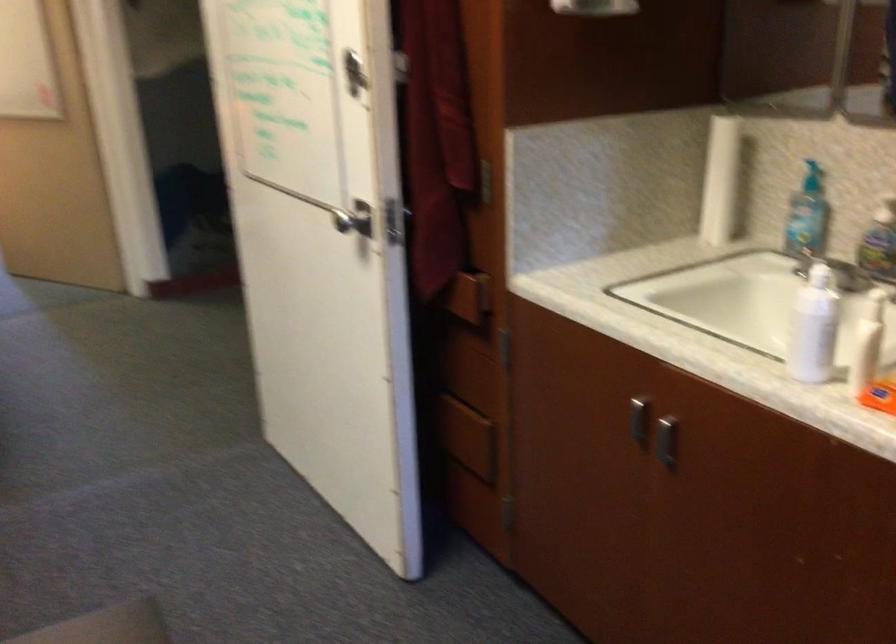
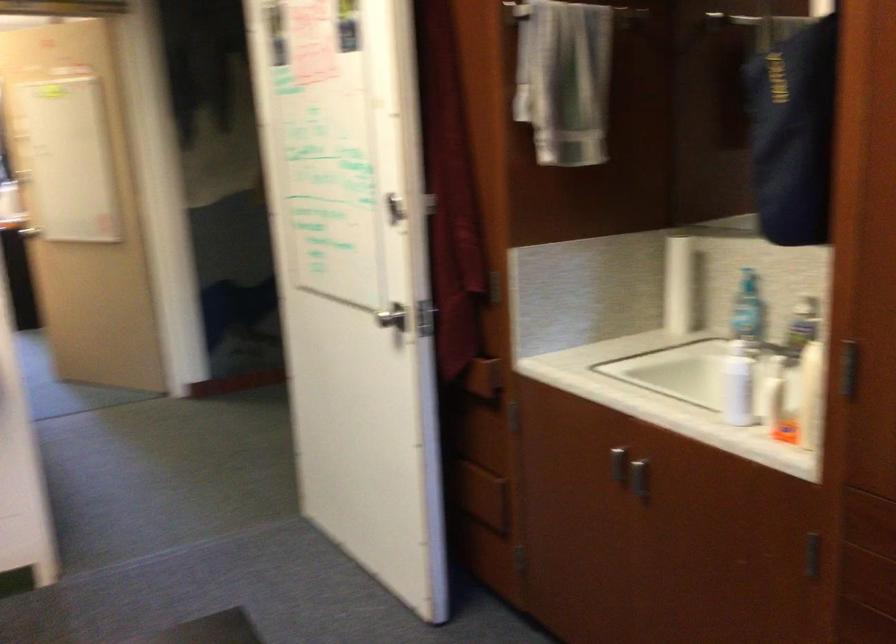
The point at (461, 433) is marked in the first image. Where is the corresponding point in the second image?

(479, 495)